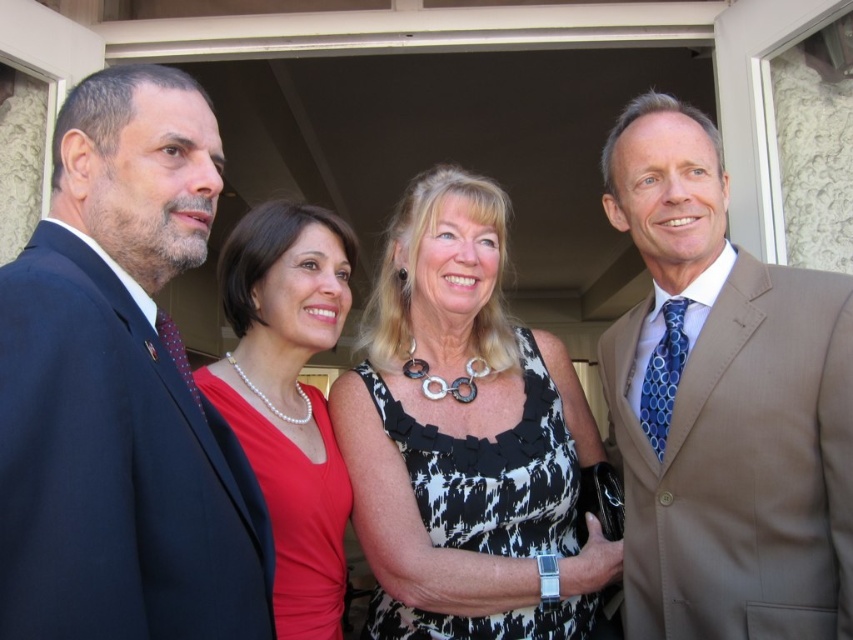
You are attending an event and need to locate two specific items in the photo. The first is the dark blue suit at left, and the second is the pearl necklace at center. Which of these two items is positioned farther to the right?

The pearl necklace at center is positioned farther to the right than the dark blue suit at left.

You are attending an event and need to locate the dark blue suit at left. Based on the coordinates provided in the scene description, can you determine its position relative to the other attendees?

The dark blue suit at left is positioned at coordinates point (120, 390), which places it on the left side of the group near the front, closer to the entrance. This coordinate places it to the left of the other attendees standing to its right.

You are a photographer at an event and need to arrange two men in suits so that their heights are proportional to their suit lengths. The dark blue suit at left is shorter than light brown suit at right. Which man should stand where to maintain the correct proportion?

The man wearing the dark blue suit at left should stand in front of the man in the light brown suit at right because the dark blue suit at left is shorter than the light brown suit at right, ensuring proper proportionality based on their suit lengths.